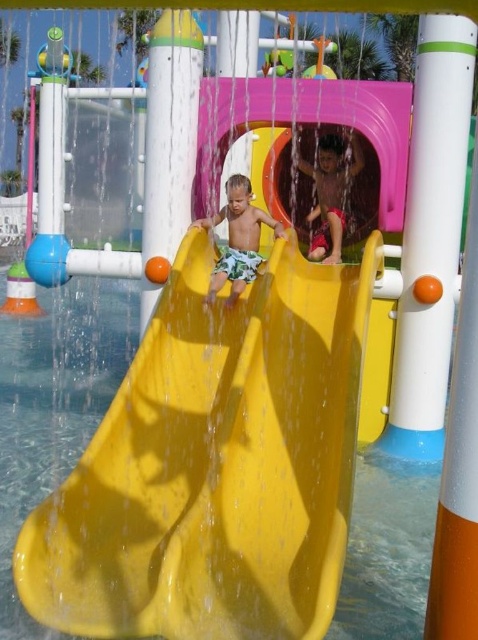
Question: Estimate the real-world distances between objects in this image. Which object is farther from the matte red shorts at center?

Choices:
 (A) matte yellow slide at center
 (B) yellow plastic slide at center

Answer: (B)

Question: Considering the relative positions of matte red shorts at center and matte yellow slide at center in the image provided, where is matte red shorts at center located with respect to matte yellow slide at center?

Choices:
 (A) above
 (B) below

Answer: (A)

Question: Is yellow plastic slide at center above matte red shorts at center?

Choices:
 (A) yes
 (B) no

Answer: (B)

Question: Which object is the closest to the matte yellow slide at center?

Choices:
 (A) matte red shorts at center
 (B) yellow plastic slide at center

Answer: (B)

Question: Among these objects, which one is nearest to the camera?

Choices:
 (A) matte yellow slide at center
 (B) yellow plastic slide at center

Answer: (B)

Question: Does matte red shorts at center have a smaller size compared to matte yellow slide at center?

Choices:
 (A) yes
 (B) no

Answer: (B)